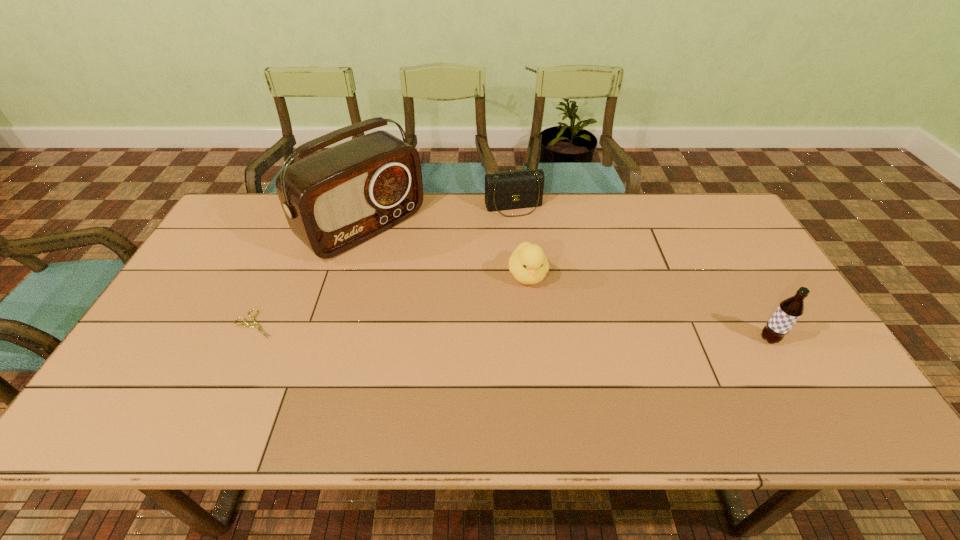
You are a GUI agent. You are given a task and a screenshot of the screen. Output one action in this format:
    pyautogui.click(x=<x>, y=<y>)
    Task: Click on the shortest object
    The image size is (960, 540).
    Given the screenshot: What is the action you would take?
    pyautogui.click(x=249, y=325)

Where is `the rightmost object`? This screenshot has height=540, width=960. the rightmost object is located at coordinates (789, 311).

What are the coordinates of `the second tallest object` in the screenshot? It's located at (789, 311).

This screenshot has width=960, height=540. I want to click on clutch bag, so click(507, 190).

This screenshot has width=960, height=540. I want to click on the tallest object, so click(334, 200).

Find the location of a particular element. duck is located at coordinates (528, 263).

Where is `vacant region located 0.090m on the back of the shears`? The height and width of the screenshot is (540, 960). vacant region located 0.090m on the back of the shears is located at coordinates (273, 286).

Locate an element on the screen. This screenshot has height=540, width=960. blank area located on the left of the fourth shortest object is located at coordinates (735, 339).

The width and height of the screenshot is (960, 540). I want to click on blank space located 0.160m on the front flap of the clutch bag, so click(532, 248).

Find the location of a particular element. vacant area situated on the front flap of the clutch bag is located at coordinates (528, 240).